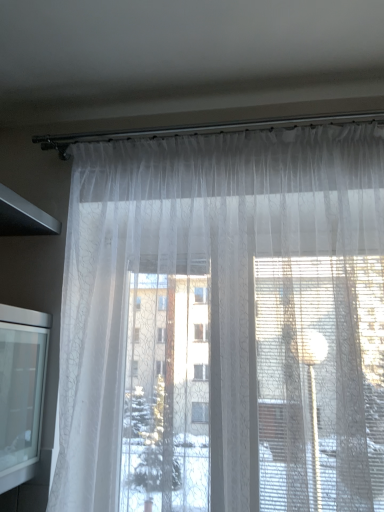
Locate an element on the screen. This screenshot has width=384, height=512. sheer white curtain at center is located at coordinates pyautogui.click(x=224, y=324).

Measure the distance between sheer white curtain at center and camera.

The distance of sheer white curtain at center from camera is 3.48 feet.

What is the approximate width of sheer white curtain at center?

sheer white curtain at center is 25.16 centimeters in width.

What do you see at coordinates (224, 324) in the screenshot? This screenshot has height=512, width=384. I see `sheer white curtain at center` at bounding box center [224, 324].

Locate an element on the screen. sheer white curtain at center is located at coordinates (224, 324).